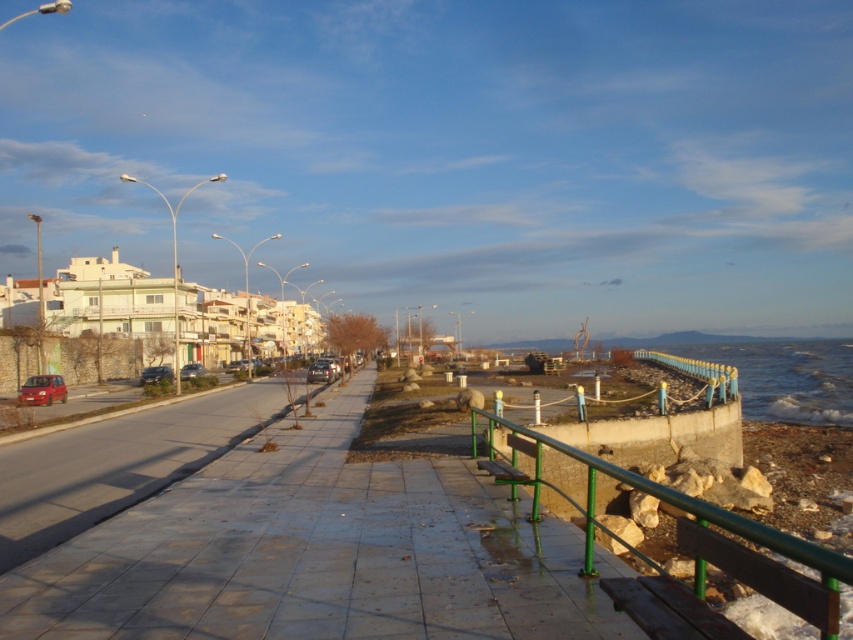
Between green metallic railing at lower right and matte black car at lower left, which one is positioned higher?

green metallic railing at lower right is above.

Is point (596, 468) in front of point (158, 368)?

That is True.

Where is `green metallic railing at lower right`? green metallic railing at lower right is located at coordinates [x=700, y=552].

Based on the photo, does smooth concrete pavement at center have a larger size compared to matte black car at lower left?

Incorrect, smooth concrete pavement at center is not larger than matte black car at lower left.

Can you confirm if smooth concrete pavement at center is positioned above matte black car at lower left?

Indeed, smooth concrete pavement at center is positioned over matte black car at lower left.

Find the location of a particular element. smooth concrete pavement at center is located at coordinates (316, 554).

The height and width of the screenshot is (640, 853). I want to click on smooth concrete pavement at center, so click(x=316, y=554).

Can you confirm if matte red hatchback at lower left is smaller than metallic silver car at center-left?

Yes.

Does matte red hatchback at lower left appear on the right side of metallic silver car at center-left?

Correct, you'll find matte red hatchback at lower left to the right of metallic silver car at center-left.

What do you see at coordinates (42, 388) in the screenshot?
I see `matte red hatchback at lower left` at bounding box center [42, 388].

In order to click on matte red hatchback at lower left in this screenshot , I will do pos(42,388).